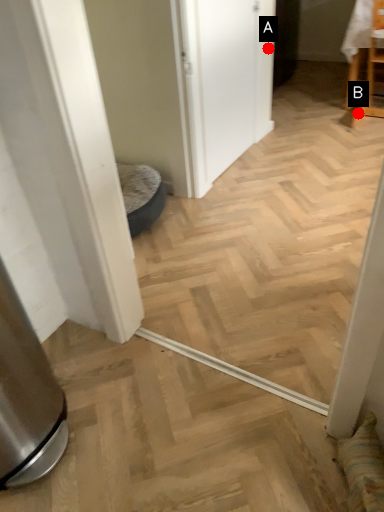
Question: Two points are circled on the image, labeled by A and B beside each circle. Which point is closer to the camera?

Choices:
 (A) A is closer
 (B) B is closer

Answer: (A)